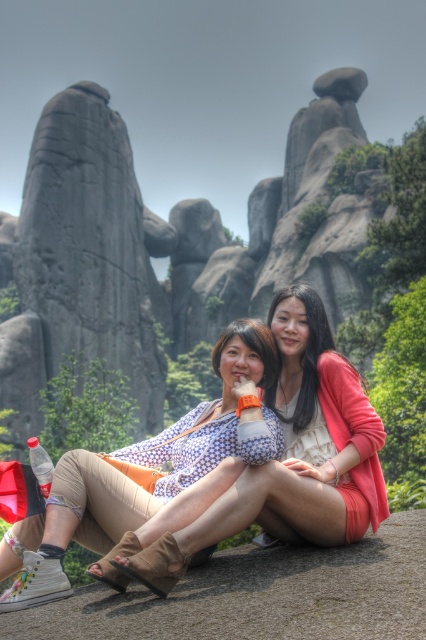
You are a photographer planning to take a portrait of the two people in the scene. You notice the brown leather shoe at lower center and the matte floral blouse at center. Which object is shorter in height?

The brown leather shoe at lower center is shorter in height than the matte floral blouse at center according to the description.

You are standing in front of the rocky landscape and want to place a small flag at the closest point to you between point A at point (118, 563) and point B at point (34, 584). Which point should you choose?

You should choose point A at point (118, 563) because it is closer to the viewer than point B at point (34, 584).